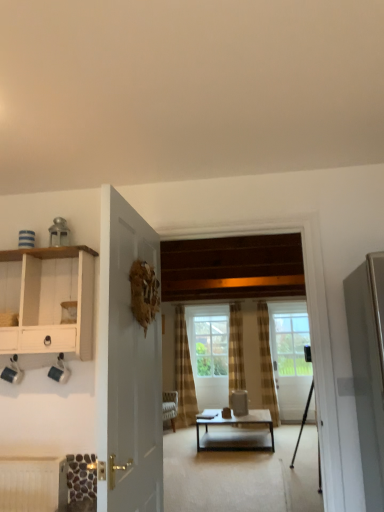
Question: Relative to white wood cabinet at left, is plaid fabric curtain at center in front or behind?

Choices:
 (A) front
 (B) behind

Answer: (B)

Question: Considering the positions of plaid fabric curtain at center and white wood cabinet at left in the image, is plaid fabric curtain at center bigger or smaller than white wood cabinet at left?

Choices:
 (A) small
 (B) big

Answer: (B)

Question: Based on their relative distances, which object is nearer to the metallic tripod at center?

Choices:
 (A) matte black coffee table at center
 (B) white wood cabinet at left
 (C) plaid fabric curtain at center
 (D) clear glass window at center
 (E) white glossy door at center, placed as the 1th door when sorted from top to bottom

Answer: (A)

Question: Which object is the closest to the white wood cabinet at left?

Choices:
 (A) clear glass window at center
 (B) clear glass door at center, positioned as the first door in back-to-front order
 (C) metallic tripod at center
 (D) white glossy door at center, placed as the 1th door when sorted from top to bottom
 (E) matte black coffee table at center

Answer: (D)